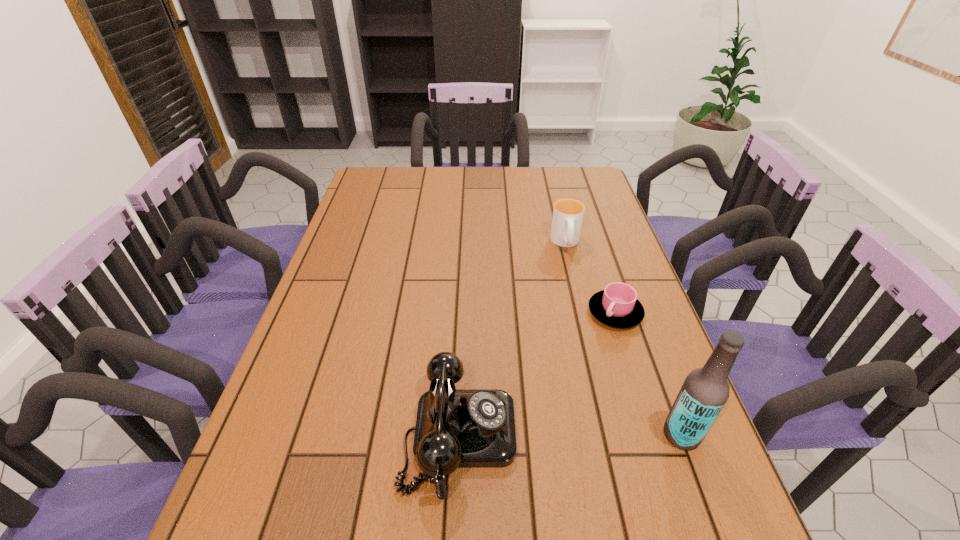
The image size is (960, 540). What are the coordinates of `telephone` in the screenshot? It's located at (455, 428).

The image size is (960, 540). What are the coordinates of `the tallest object` in the screenshot? It's located at (705, 391).

Where is `the third nearest object`? This screenshot has width=960, height=540. the third nearest object is located at coordinates (617, 306).

Find the location of a particular element. This screenshot has width=960, height=540. the shorter cup is located at coordinates (617, 306).

Find the location of a particular element. the farthest object is located at coordinates (567, 219).

The image size is (960, 540). I want to click on the taller cup, so click(567, 219).

Find the location of a particular element. Image resolution: width=960 pixels, height=540 pixels. vacant region located on the dial of the leftmost object is located at coordinates (698, 435).

The image size is (960, 540). Find the location of `free spot located on the label of the tallest object`. free spot located on the label of the tallest object is located at coordinates (490, 434).

Locate an element on the screen. The width and height of the screenshot is (960, 540). vacant space located on the label of the tallest object is located at coordinates tap(494, 434).

This screenshot has width=960, height=540. I want to click on vacant space located on the label of the tallest object, so click(485, 434).